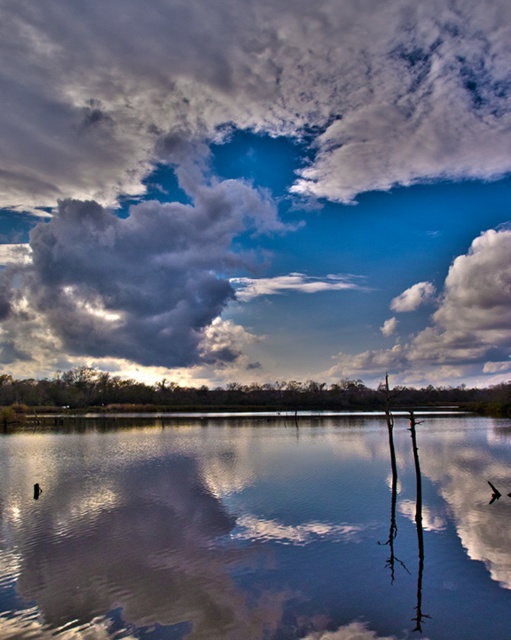
Between cloudy sky at upper center and smooth reflective water at center, which one appears on the left side from the viewer's perspective?

From the viewer's perspective, cloudy sky at upper center appears more on the left side.

Is the position of cloudy sky at upper center more distant than that of smooth reflective water at center?

Yes.

This screenshot has height=640, width=511. I want to click on cloudy sky at upper center, so click(256, 189).